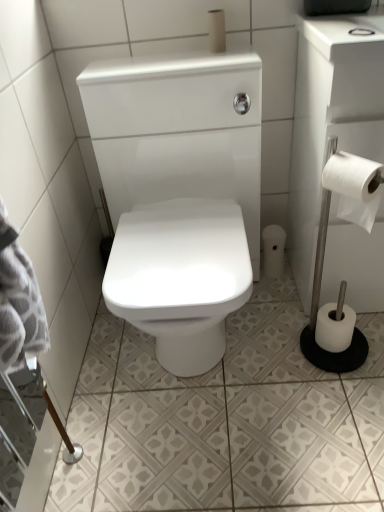
At what (x,y) coordinates should I click in order to perform the action: click on vacant point above white glossy ceramic tile at center (from a real-world perspective). Please return your answer as a coordinate pair (x, y). The image size is (384, 512). Looking at the image, I should click on (253, 378).